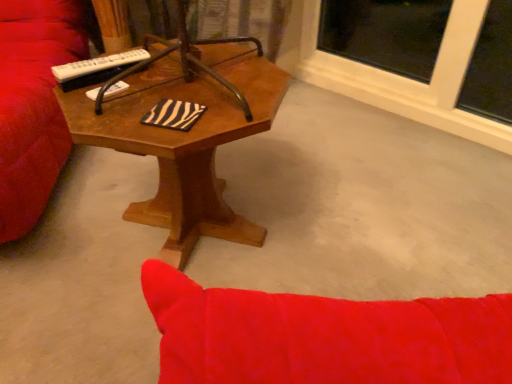
The width and height of the screenshot is (512, 384). What are the coordinates of `vacant space underneath wooden coffee table at center (from a real-world perspective)` in the screenshot? It's located at (199, 238).